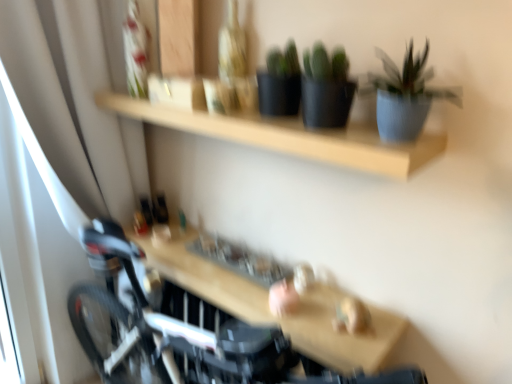
Question: Based on their positions, is wooden shelf at center located to the left or right of blue matte pot at upper right?

Choices:
 (A) right
 (B) left

Answer: (B)

Question: Considering the positions of point (265, 304) and point (422, 59), is point (265, 304) closer or farther from the camera than point (422, 59)?

Choices:
 (A) farther
 (B) closer

Answer: (A)

Question: From their relative heights in the image, would you say wooden shelf at center is taller or shorter than blue matte pot at upper right?

Choices:
 (A) tall
 (B) short

Answer: (B)

Question: Based on their sizes in the image, would you say blue matte pot at upper right is bigger or smaller than wooden shelf at center?

Choices:
 (A) big
 (B) small

Answer: (B)

Question: Is point (424, 89) closer or farther from the camera than point (366, 334)?

Choices:
 (A) farther
 (B) closer

Answer: (B)

Question: From a real-world perspective, is blue matte pot at upper right positioned above or below wooden shelf at center?

Choices:
 (A) above
 (B) below

Answer: (A)

Question: Would you say blue matte pot at upper right is to the left or to the right of wooden shelf at center in the picture?

Choices:
 (A) right
 (B) left

Answer: (A)